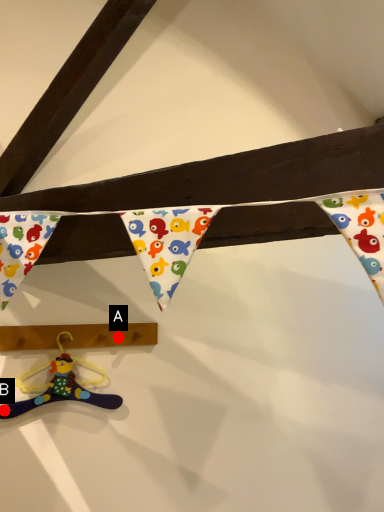
Question: Two points are circled on the image, labeled by A and B beside each circle. Which point is closer to the camera taking this photo?

Choices:
 (A) A is closer
 (B) B is closer

Answer: (B)